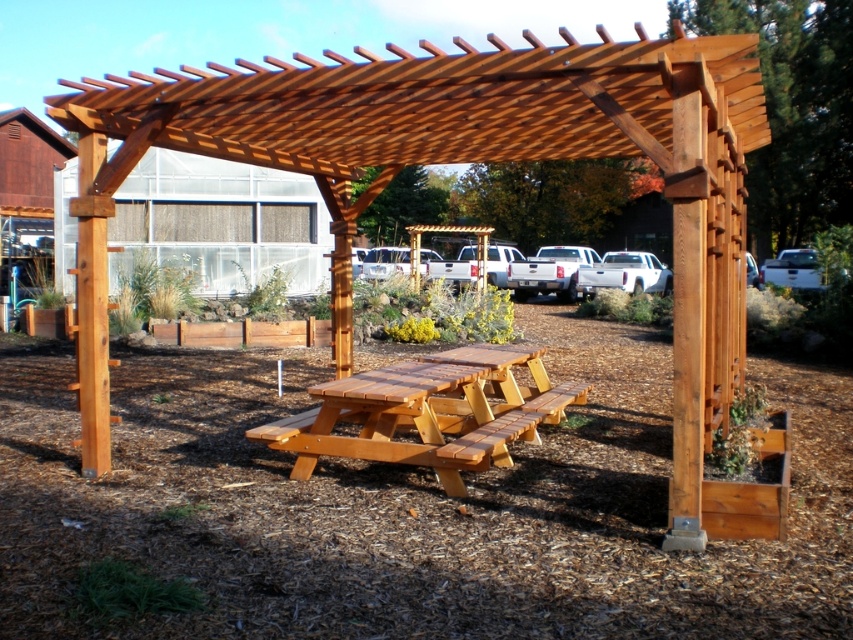
Is point (708, 513) in front of point (532, 369)?

Yes, point (708, 513) is closer to viewer.

Is natural wood pergola at center below natural wood picnic table at center?

No, natural wood pergola at center is not below natural wood picnic table at center.

Locate an element on the screen. The width and height of the screenshot is (853, 640). natural wood pergola at center is located at coordinates click(479, 160).